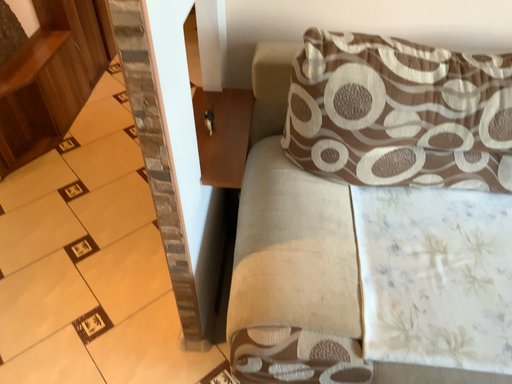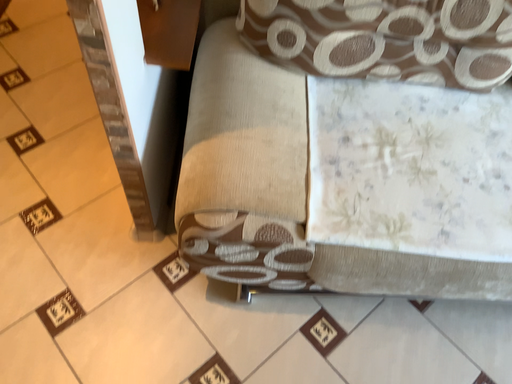
Question: Which way did the camera rotate in the video?

Choices:
 (A) rotated downward
 (B) rotated upward

Answer: (A)